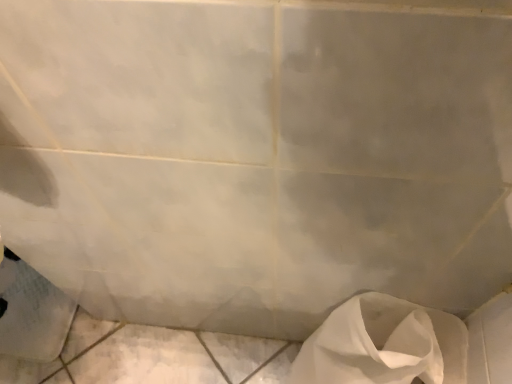
Describe the element at coordinates (384, 344) in the screenshot. The width and height of the screenshot is (512, 384). I see `white paper at lower right` at that location.

Identify the location of white paper at lower right. (384, 344).

Locate an element on the screen. This screenshot has width=512, height=384. white paper at lower right is located at coordinates (384, 344).